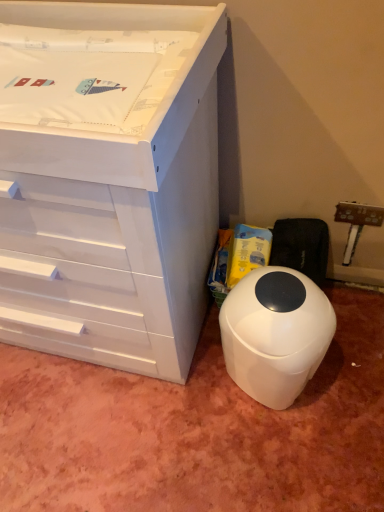
Question: Is white glossy chest of drawers at upper left taller or shorter than white plastic waste bin at lower right?

Choices:
 (A) tall
 (B) short

Answer: (A)

Question: From a real-world perspective, is white glossy chest of drawers at upper left physically located above or below white plastic waste bin at lower right?

Choices:
 (A) below
 (B) above

Answer: (B)

Question: Visually, is white glossy chest of drawers at upper left positioned to the left or to the right of white plastic waste bin at lower right?

Choices:
 (A) right
 (B) left

Answer: (B)

Question: Based on their sizes in the image, would you say white plastic waste bin at lower right is bigger or smaller than white glossy chest of drawers at upper left?

Choices:
 (A) big
 (B) small

Answer: (B)

Question: Would you say white plastic waste bin at lower right is to the left or to the right of white glossy chest of drawers at upper left in the picture?

Choices:
 (A) right
 (B) left

Answer: (A)

Question: Considering the positions of white plastic waste bin at lower right and white glossy chest of drawers at upper left in the image, is white plastic waste bin at lower right wider or thinner than white glossy chest of drawers at upper left?

Choices:
 (A) wide
 (B) thin

Answer: (B)

Question: From the image's perspective, is white plastic waste bin at lower right located above or below white glossy chest of drawers at upper left?

Choices:
 (A) below
 (B) above

Answer: (A)